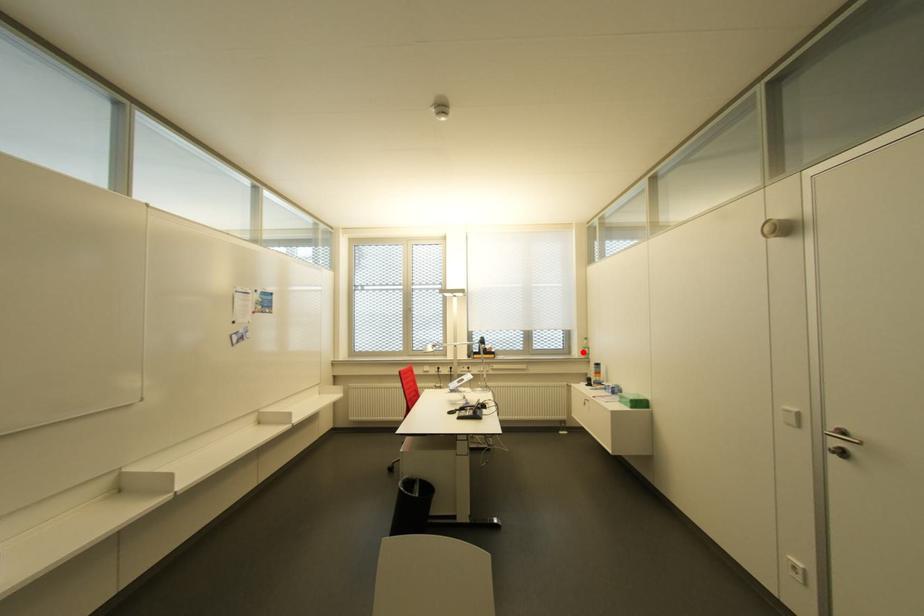
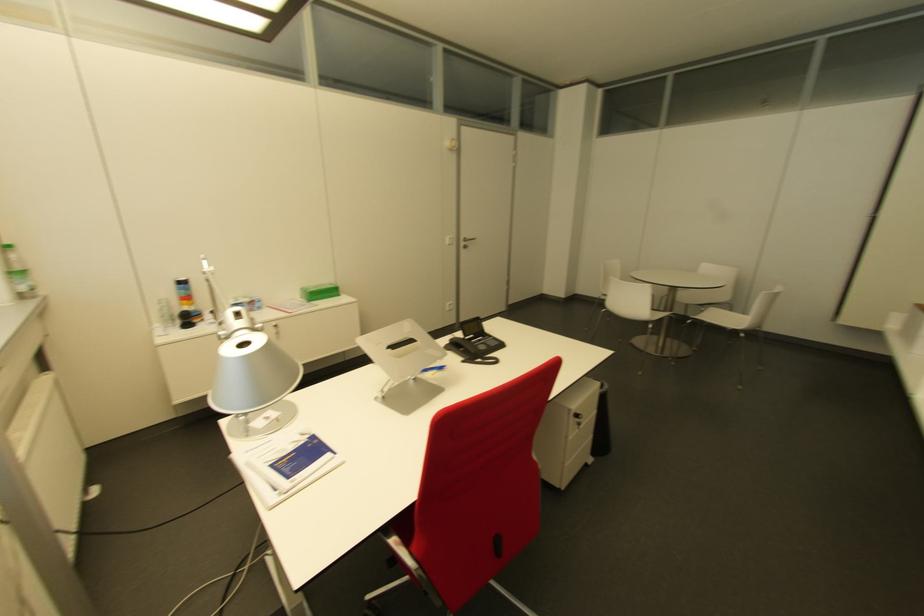
Question: I am providing you with two images of the same scene from different viewpoints. Given a red point in image1, look at the same physical point in image2. Is it:

Choices:
 (A) Closer to the viewpoint
 (B) Farther from the viewpoint

Answer: (B)